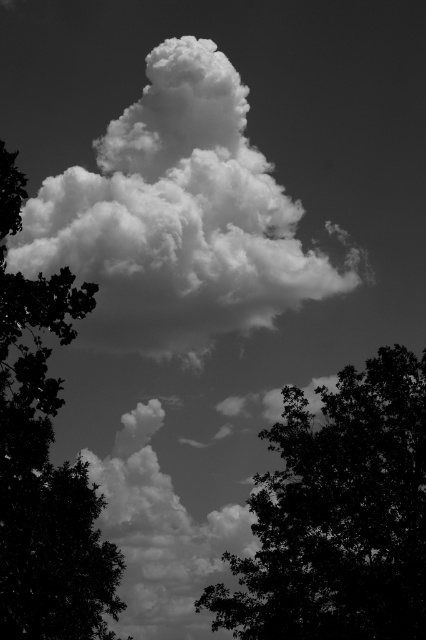
You are an artist analyzing the composition of this black and white photograph. You notice two silhouette leafy trees. Which one, the silhouette leafy tree at center or the silhouette leafy tree at left, appears wider in the image?

The silhouette leafy tree at left is wider than the silhouette leafy tree at center.

You are an artist trying to paint this scene. You notice two silhouette leafy trees in the foreground. Which tree, the silhouette leafy tree at center or the silhouette leafy tree at left, is closer to the left edge of the image?

The silhouette leafy tree at left is closer to the left edge of the image because it is positioned to the left of the silhouette leafy tree at center.